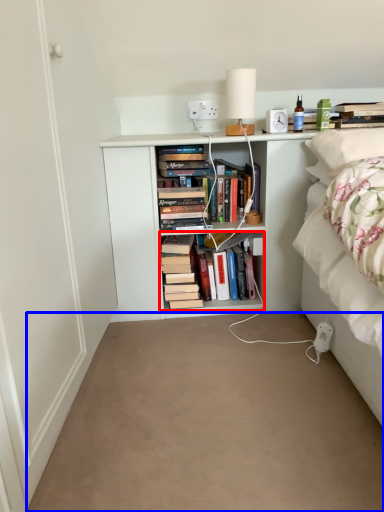
Question: Which point is further to the camera, book (highlighted by a red box) or plain (highlighted by a blue box)?

Choices:
 (A) book
 (B) plain

Answer: (A)